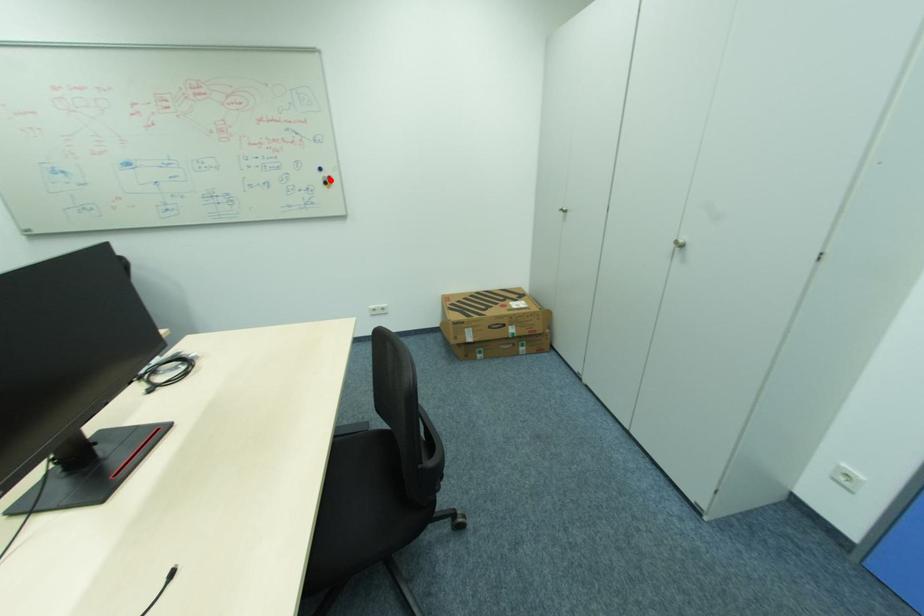
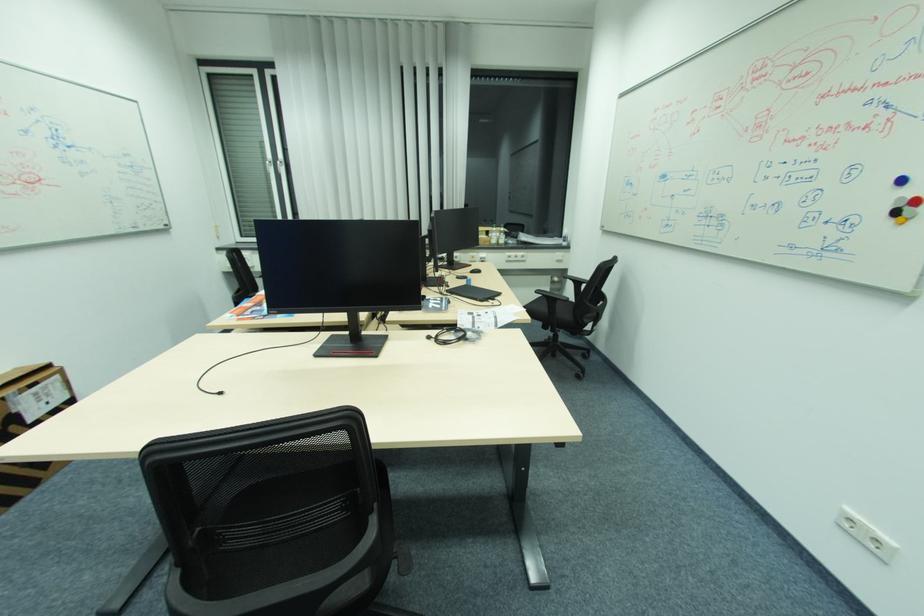
Question: I am providing you with two images of the same scene from different viewpoints. Given a red point in image1, look at the same physical point in image2. Is it:

Choices:
 (A) Closer to the viewpoint
 (B) Farther from the viewpoint

Answer: (B)